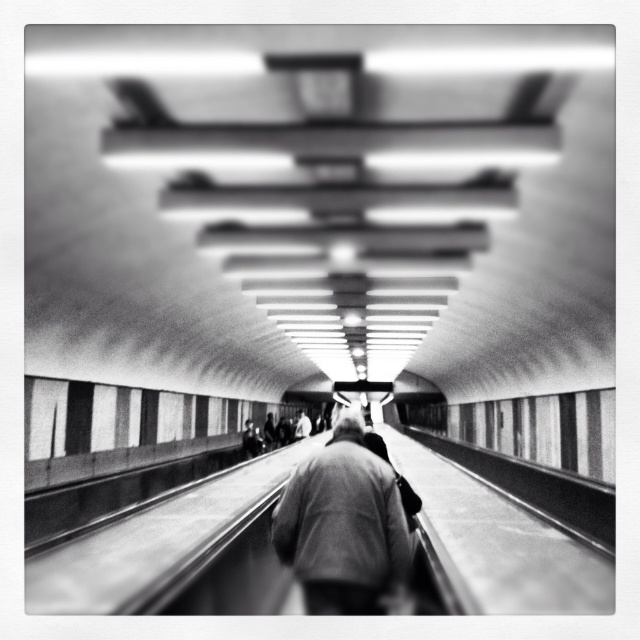
Question: Which point is closer to the camera taking this photo?

Choices:
 (A) (339, 561)
 (B) (298, 422)

Answer: (A)

Question: Is dark gray wool coat at center below light gray fabric jacket at center?

Choices:
 (A) no
 (B) yes

Answer: (A)

Question: Is the position of dark gray wool coat at center more distant than that of light gray fabric jacket at center?

Choices:
 (A) yes
 (B) no

Answer: (B)

Question: Can you confirm if dark gray wool coat at center is smaller than light gray fabric jacket at center?

Choices:
 (A) yes
 (B) no

Answer: (B)

Question: Which point appears closest to the camera in this image?

Choices:
 (A) (307, 611)
 (B) (301, 413)

Answer: (A)